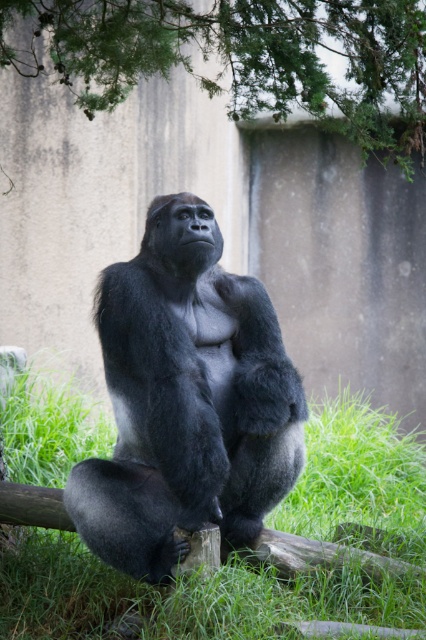
In the scene shown: Can you confirm if green grass at lower center is positioned to the right of green leafy tree at upper center?

Indeed, green grass at lower center is positioned on the right side of green leafy tree at upper center.

Does green grass at lower center come behind green leafy tree at upper center?

Yes, green grass at lower center is further from the viewer.

What do you see at coordinates (181, 596) in the screenshot?
I see `green grass at lower center` at bounding box center [181, 596].

Find the location of a particular element. The height and width of the screenshot is (640, 426). green grass at lower center is located at coordinates (181, 596).

Does shiny black gorilla at center appear on the right side of green grass at lower center?

In fact, shiny black gorilla at center is to the left of green grass at lower center.

From the picture: Which is more to the left, shiny black gorilla at center or green grass at lower center?

shiny black gorilla at center is more to the left.

The image size is (426, 640). Find the location of `shiny black gorilla at center`. shiny black gorilla at center is located at coordinates (186, 400).

In the scene shown: Can you confirm if shiny black gorilla at center is thinner than green leafy tree at upper center?

Indeed, shiny black gorilla at center has a lesser width compared to green leafy tree at upper center.

Where is `shiny black gorilla at center`? shiny black gorilla at center is located at coordinates (186, 400).

At what (x,y) coordinates should I click in order to perform the action: click on shiny black gorilla at center. Please return your answer as a coordinate pair (x, y). This screenshot has width=426, height=640. Looking at the image, I should click on (186, 400).